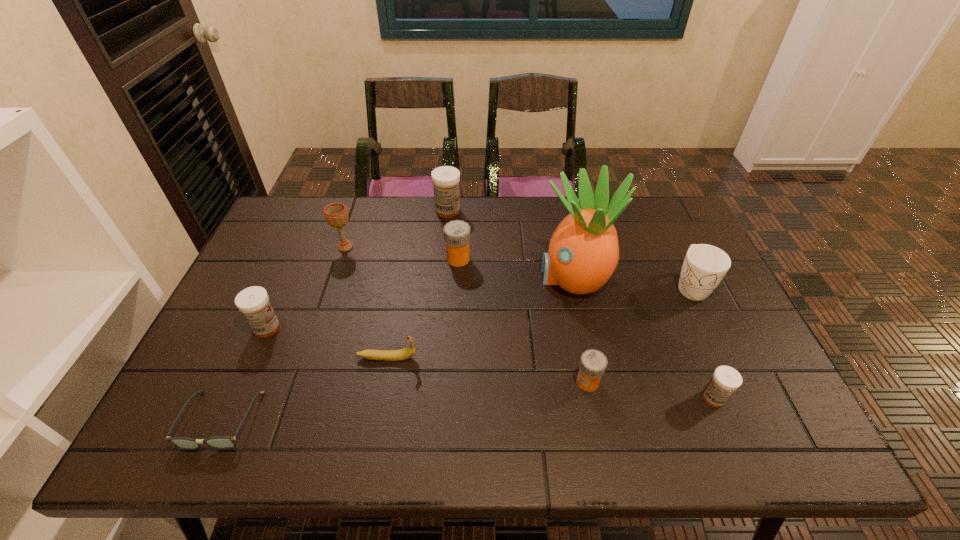
Find the location of a particular element. white medicine that is the third closest to the orange pineapple is located at coordinates (253, 302).

Find the location of a particular element. the third closest white medicine to the mug is located at coordinates (253, 302).

You are a GUI agent. You are given a task and a screenshot of the screen. Output one action in this format:
    pyautogui.click(x=<x>, y=<y>)
    Task: Click on the free space that satisfies the following two spatial constraints: 1. on the side of the mug with the handle; 2. at the stem of the banana
    This screenshot has width=960, height=540.
    Given the screenshot: What is the action you would take?
    pyautogui.click(x=724, y=357)

The width and height of the screenshot is (960, 540). In order to click on blank area in the image that satisfies the following two spatial constraints: 1. on the label side of the farther orange medicine; 2. on the right side of the rightmost white medicine in this screenshot , I will do click(x=451, y=398).

At what (x,y) coordinates should I click in order to perform the action: click on vacant space that satisfies the following two spatial constraints: 1. on the side of the mug with the handle; 2. at the stem of the yellow banana. Please return your answer as a coordinate pair (x, y). The height and width of the screenshot is (540, 960). Looking at the image, I should click on (724, 357).